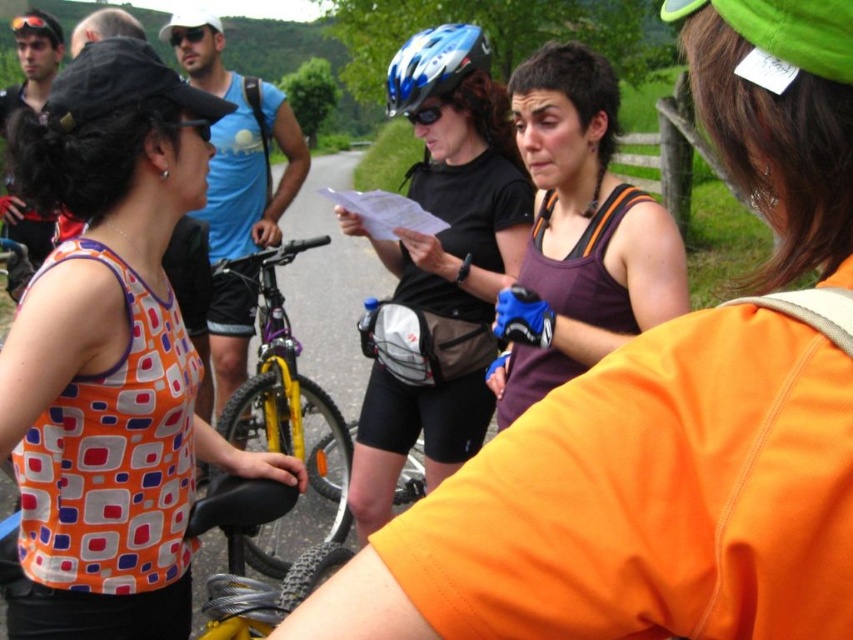
Does orange printed tank top at left have a smaller size compared to blue glossy bicycle helmet at center?

Incorrect, orange printed tank top at left is not smaller in size than blue glossy bicycle helmet at center.

Consider the image. Which is below, orange printed tank top at left or blue glossy bicycle helmet at center?

orange printed tank top at left

The width and height of the screenshot is (853, 640). Identify the location of orange printed tank top at left. (109, 356).

The image size is (853, 640). I want to click on orange printed tank top at left, so click(109, 356).

Who is more distant from viewer, (544, 193) or (465, 42)?

The point (465, 42) is behind.

Is purple fabric tank top at center wider than blue glossy bicycle helmet at center?

Indeed, purple fabric tank top at center has a greater width compared to blue glossy bicycle helmet at center.

Is point (656, 310) farther from camera compared to point (427, 60)?

That is False.

The height and width of the screenshot is (640, 853). Identify the location of purple fabric tank top at center. (579, 232).

Who is positioned more to the right, matte black tank top at center or yellow metallic bicycle at center?

From the viewer's perspective, matte black tank top at center appears more on the right side.

The image size is (853, 640). Find the location of `matte black tank top at center`. matte black tank top at center is located at coordinates (634, 504).

This screenshot has height=640, width=853. I want to click on matte black tank top at center, so click(x=634, y=504).